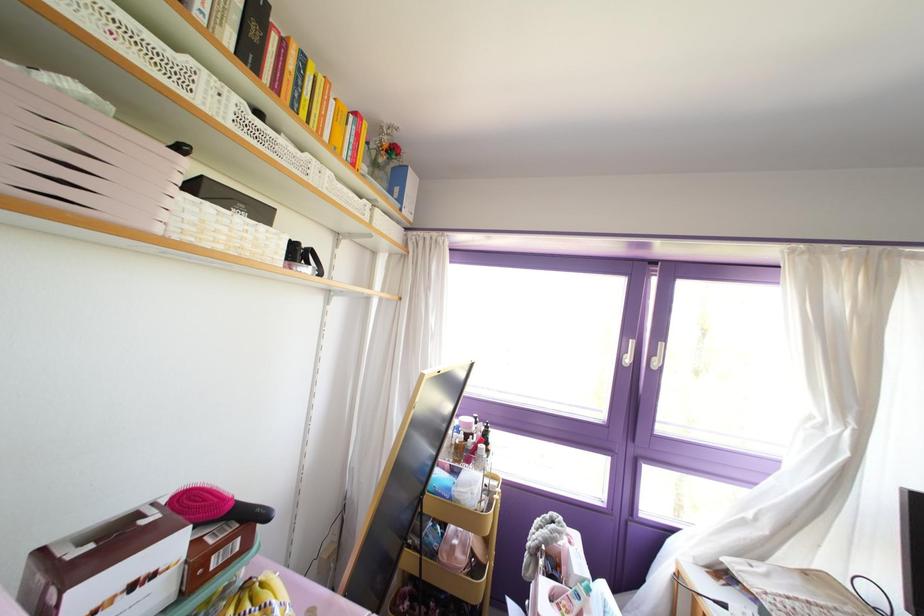
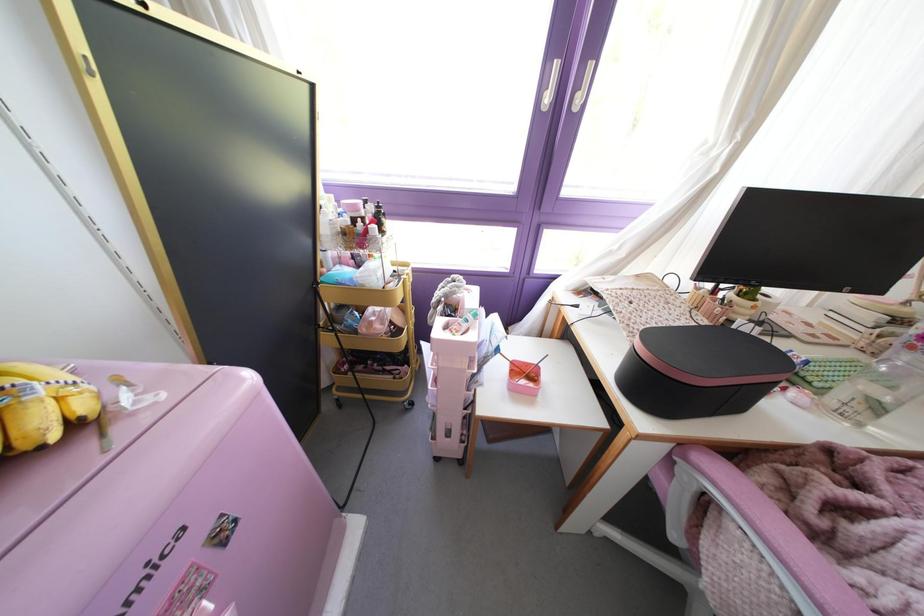
Question: The images are taken continuously from a first-person perspective. In which direction is your viewpoint rotating?

Choices:
 (A) Left
 (B) Right
 (C) Up
 (D) Down

Answer: (D)